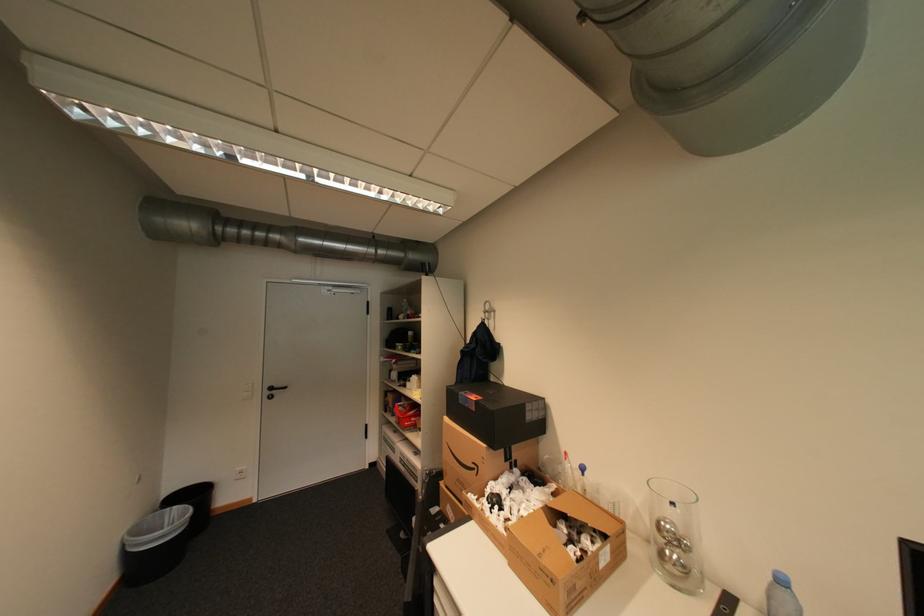
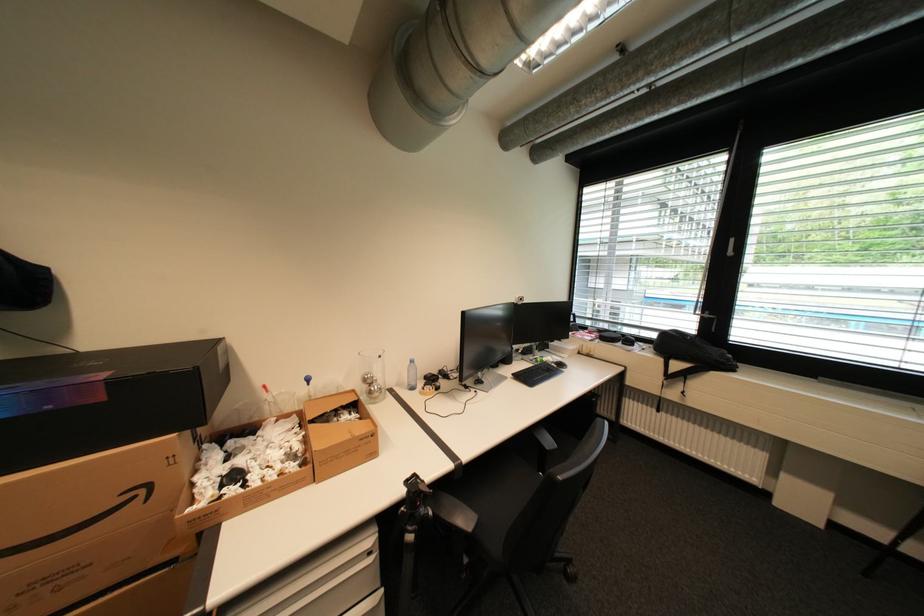
The point at (484, 468) is marked in the first image. Where is the corresponding point in the second image?

(151, 491)